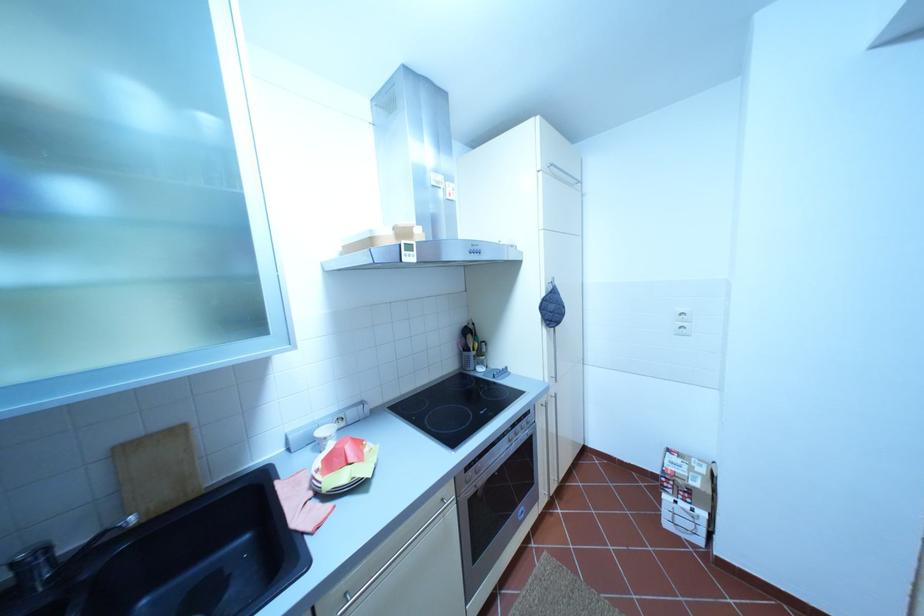
Which object does [323,435] point to?

It corresponds to the small white bowl in the image.